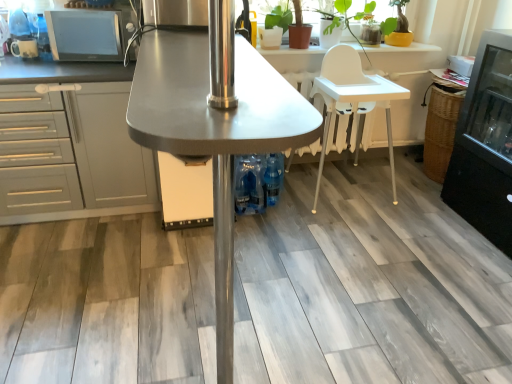
Identify the location of free spot in front of gray matte cabinet at left. (72, 286).